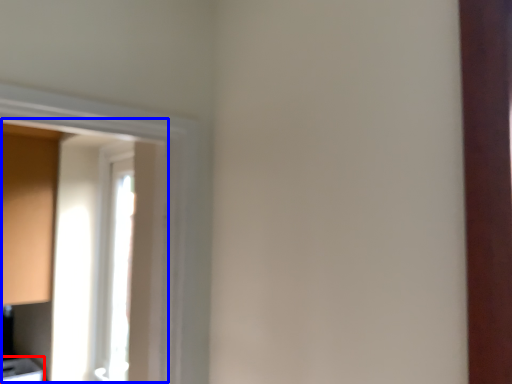
Question: Among these objects, which one is nearest to the camera, cabinetry (highlighted by a red box) or window screen (highlighted by a blue box)?

Choices:
 (A) cabinetry
 (B) window screen

Answer: (B)